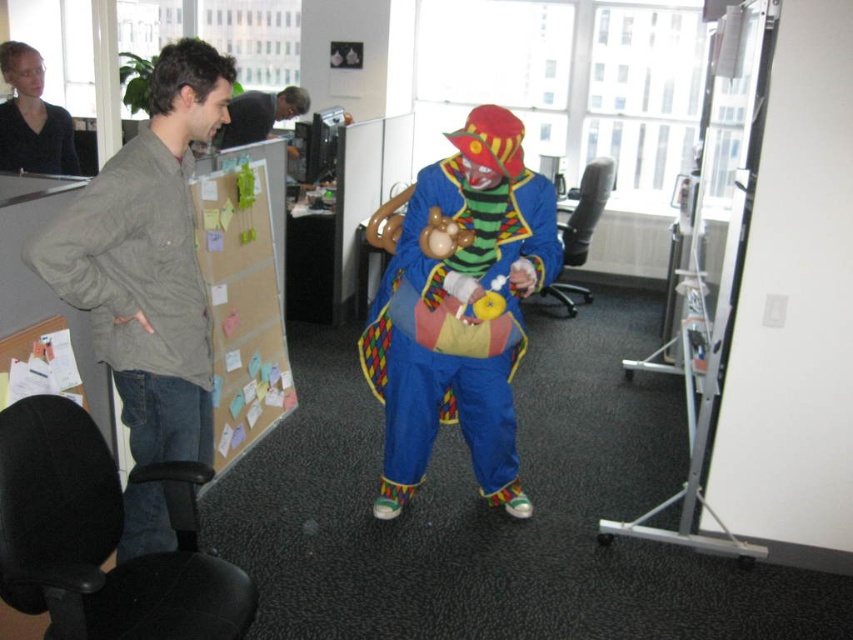
Question: Can you confirm if matte gray jacket at left is positioned to the right of matte black shirt at upper left?

Choices:
 (A) no
 (B) yes

Answer: (B)

Question: In this image, where is matte blue clown costume at center located relative to matte black shirt at upper left?

Choices:
 (A) right
 (B) left

Answer: (A)

Question: Which object is positioned farthest from the corkboard at left?

Choices:
 (A) matte gray jacket at left
 (B) matte blue clown costume at center
 (C) matte black shirt at upper left

Answer: (C)

Question: Based on their relative distances, which object is farther from the matte blue clown costume at center?

Choices:
 (A) matte black shirt at upper left
 (B) corkboard at left
 (C) smooth black hair at upper center
 (D) matte gray jacket at left

Answer: (A)

Question: Which object appears farthest from the camera in this image?

Choices:
 (A) corkboard at left
 (B) smooth black hair at upper center
 (C) matte blue clown costume at center

Answer: (B)

Question: Is matte gray jacket at left above matte black shirt at upper left?

Choices:
 (A) no
 (B) yes

Answer: (A)